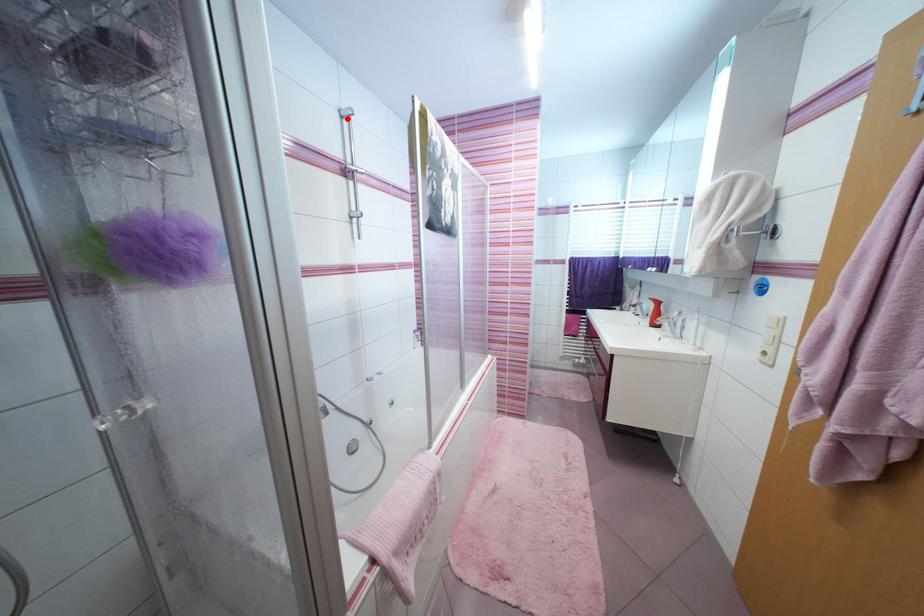
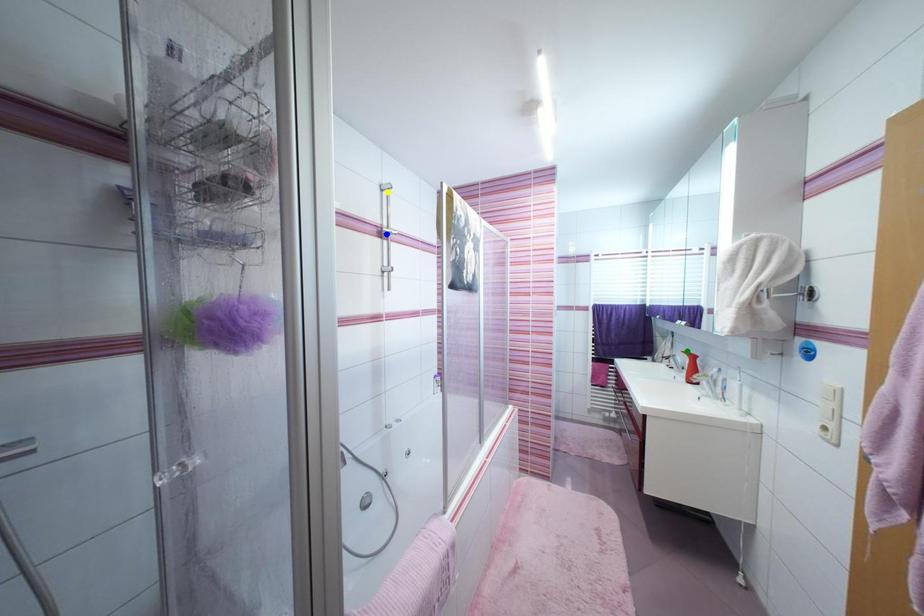
Question: I am providing you with two images of the same scene from different viewpoints. A red point is marked on the first image. You are given multiple points on the second image. Which mark in image 2 goes with the point in image 1?

Choices:
 (A) blue point
 (B) green point
 (C) yellow point

Answer: (C)